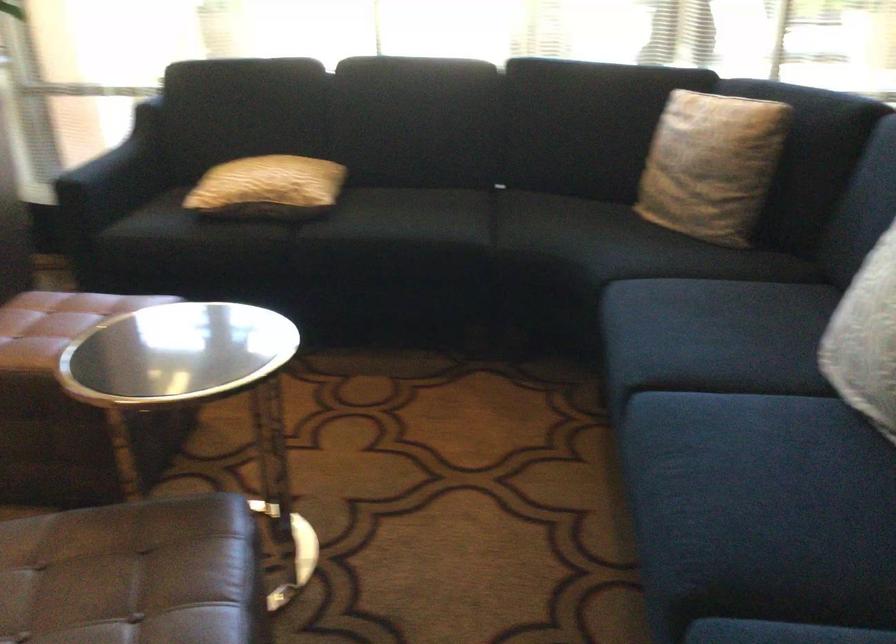
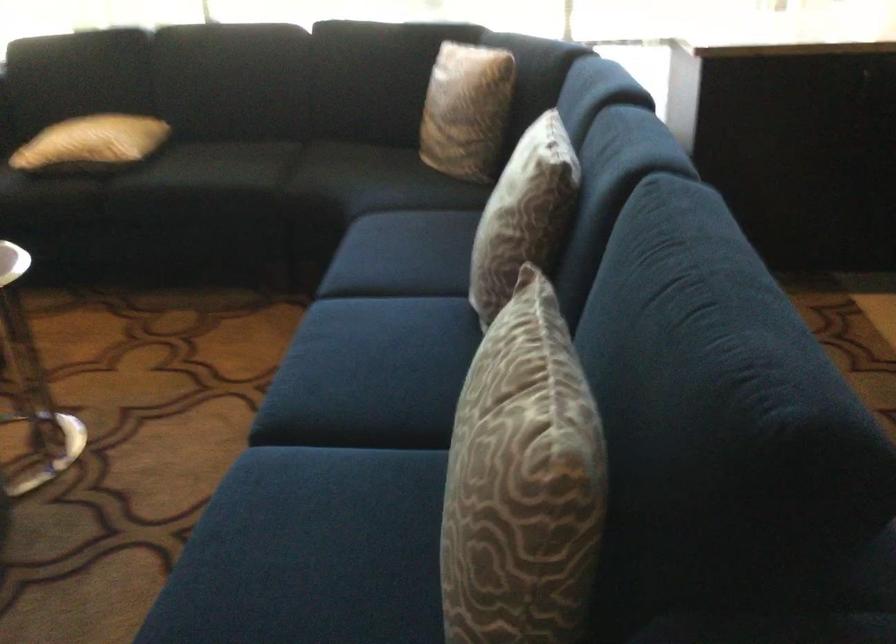
Locate, in the second image, the point that corresponds to point (254, 98) in the first image.

(82, 64)